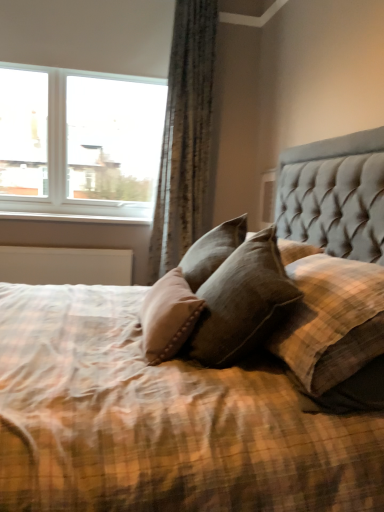
This screenshot has width=384, height=512. What do you see at coordinates (79, 142) in the screenshot?
I see `white glass window at upper left` at bounding box center [79, 142].

The width and height of the screenshot is (384, 512). In order to click on white glass window at upper left in this screenshot , I will do `click(79, 142)`.

What's the angular difference between brown textured pillow at center and textured gray curtain at upper left's facing directions?

100 degrees.

Are brown textured pillow at center and textured gray curtain at upper left making contact?

No, brown textured pillow at center is not beside textured gray curtain at upper left.

Between brown textured pillow at center and textured gray curtain at upper left, which one is positioned behind?

textured gray curtain at upper left is more distant.

Is brown textured pillow at center at the left side of textured gray curtain at upper left?

No.

This screenshot has height=512, width=384. What are the coordinates of `curtain in front of the white glass window at upper left` in the screenshot? It's located at (185, 137).

Is point (127, 185) closer to viewer compared to point (171, 215)?

No, (127, 185) is further to viewer.

Considering the relative positions of white glass window at upper left and textured gray curtain at upper left in the image provided, is white glass window at upper left to the right of textured gray curtain at upper left from the viewer's perspective?

In fact, white glass window at upper left is to the left of textured gray curtain at upper left.

Is white glass window at upper left bigger or smaller than textured gray curtain at upper left?

Considering their sizes, white glass window at upper left takes up more space than textured gray curtain at upper left.

Is textured gray curtain at upper left looking in the opposite direction of white glass window at upper left?

No, textured gray curtain at upper left's orientation is not away from white glass window at upper left.

Considering the relative positions of textured gray curtain at upper left and white glass window at upper left in the image provided, is textured gray curtain at upper left to the right of white glass window at upper left from the viewer's perspective?

Correct, you'll find textured gray curtain at upper left to the right of white glass window at upper left.

How far apart are textured gray curtain at upper left and white glass window at upper left?

They are 23.00 inches apart.

How different are the orientations of textured gray curtain at upper left and white glass window at upper left in degrees?

The facing directions of textured gray curtain at upper left and white glass window at upper left are 0.586 degrees apart.

Is brown textured pillow at center situated inside white glass window at upper left or outside?

brown textured pillow at center is spatially situated outside white glass window at upper left.

Image resolution: width=384 pixels, height=512 pixels. I want to click on pillow that is under the white glass window at upper left (from a real-world perspective), so click(331, 321).

Considering the relative sizes of brown textured pillow at center and white glass window at upper left in the image provided, is brown textured pillow at center shorter than white glass window at upper left?

Yes, brown textured pillow at center is shorter than white glass window at upper left.

Could you tell me if white glass window at upper left is facing brown textured pillow at center?

Yes, white glass window at upper left faces towards brown textured pillow at center.

Does white glass window at upper left appear on the left side of brown textured pillow at center?

Indeed, white glass window at upper left is positioned on the left side of brown textured pillow at center.

Considering the sizes of objects white glass window at upper left and brown textured pillow at center in the image provided, who is wider, white glass window at upper left or brown textured pillow at center?

brown textured pillow at center.

Who is shorter, white glass window at upper left or brown textured pillow at center?

Standing shorter between the two is brown textured pillow at center.

Considering the sizes of objects textured gray curtain at upper left and brown textured pillow at center in the image provided, who is wider, textured gray curtain at upper left or brown textured pillow at center?

Wider between the two is brown textured pillow at center.

Which is more to the right, textured gray curtain at upper left or brown textured pillow at center?

From the viewer's perspective, brown textured pillow at center appears more on the right side.

From the picture: Is textured gray curtain at upper left turned away from brown textured pillow at center?

textured gray curtain at upper left is not turned away from brown textured pillow at center.

Is point (194, 156) less distant than point (324, 315)?

No, (194, 156) is behind (324, 315).

You are a GUI agent. You are given a task and a screenshot of the screen. Output one action in this format:
    pyautogui.click(x=<x>, y=<y>)
    Task: Click on the pillow located below the textured gray curtain at upper left (from the image's perspective)
    
    Given the screenshot: What is the action you would take?
    pyautogui.click(x=331, y=321)

Locate an element on the screen. This screenshot has width=384, height=512. curtain located in front of the white glass window at upper left is located at coordinates (185, 137).

From the picture: Looking at the image, which one is located further to white glass window at upper left, textured gray curtain at upper left or brown textured pillow at center?

brown textured pillow at center.

Considering their positions, is white glass window at upper left positioned further to textured gray curtain at upper left than brown textured pillow at center?

brown textured pillow at center lies further to textured gray curtain at upper left than the other object.

When comparing their distances from white glass window at upper left, does brown textured pillow at center or textured gray curtain at upper left seem closer?

Based on the image, textured gray curtain at upper left appears to be nearer to white glass window at upper left.

From the image, which object appears to be farther from textured gray curtain at upper left, brown textured pillow at center or white glass window at upper left?

brown textured pillow at center is positioned further to the anchor textured gray curtain at upper left.

Looking at the image, which one is located further to brown textured pillow at center, white glass window at upper left or textured gray curtain at upper left?

Among the two, white glass window at upper left is located further to brown textured pillow at center.

Based on the photo, considering their positions, is textured gray curtain at upper left positioned closer to brown textured pillow at center than white glass window at upper left?

textured gray curtain at upper left.

Where is `curtain positioned between brown textured pillow at center and white glass window at upper left from near to far`? This screenshot has width=384, height=512. curtain positioned between brown textured pillow at center and white glass window at upper left from near to far is located at coordinates (185, 137).